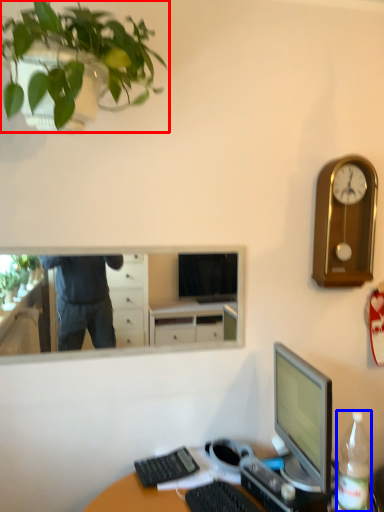
Question: Which object is further to the camera taking this photo, houseplant (highlighted by a red box) or bottle (highlighted by a blue box)?

Choices:
 (A) houseplant
 (B) bottle

Answer: (B)